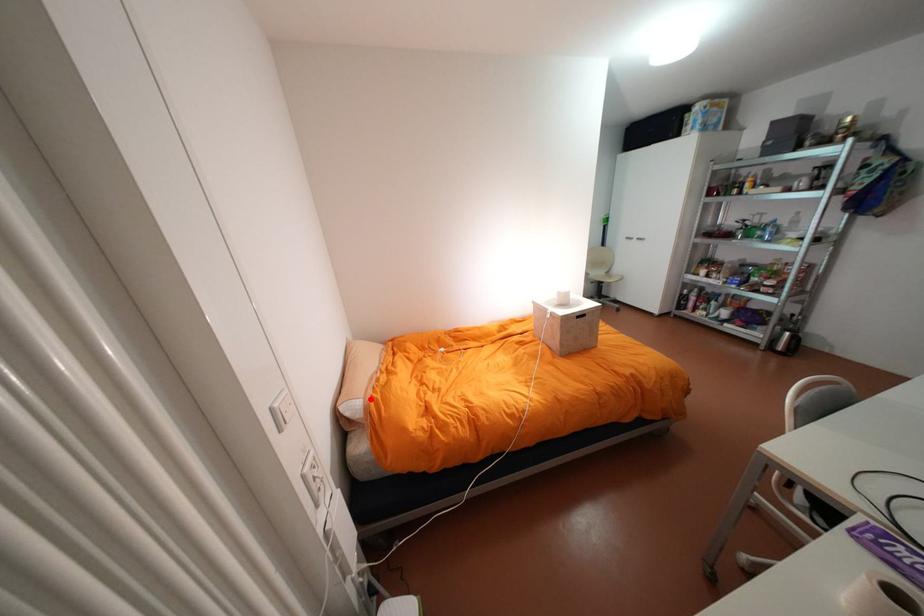
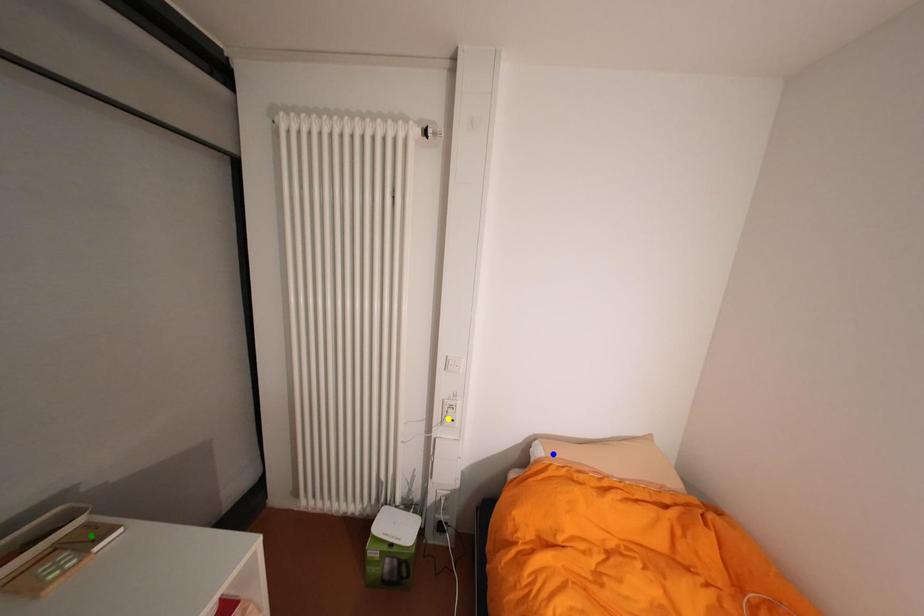
Question: I am providing you with two images of the same scene from different viewpoints. A red point is marked on the first image. You are given multiple points on the second image. Which point in image 2 is actually the same real-world point as the red point in image 1?

Choices:
 (A) blue point
 (B) green point
 (C) yellow point

Answer: (A)